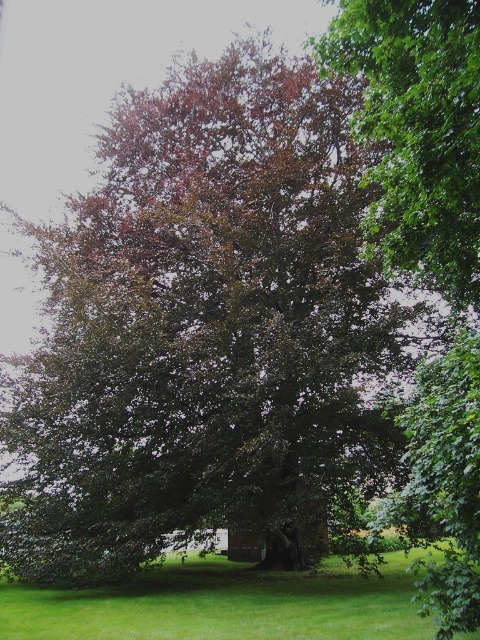
Question: Among these objects, which one is nearest to the camera?

Choices:
 (A) green leafy tree at upper right
 (B) green grass at lower center

Answer: (A)

Question: Does green leafy tree at upper right appear on the right side of green grass at lower center?

Choices:
 (A) yes
 (B) no

Answer: (A)

Question: Is green leafy tree at upper right further to camera compared to green grass at lower center?

Choices:
 (A) yes
 (B) no

Answer: (B)

Question: Is green leafy tree at upper right below green grass at lower center?

Choices:
 (A) yes
 (B) no

Answer: (B)

Question: Among these points, which one is farthest from the camera?

Choices:
 (A) (133, 589)
 (B) (404, 33)

Answer: (A)